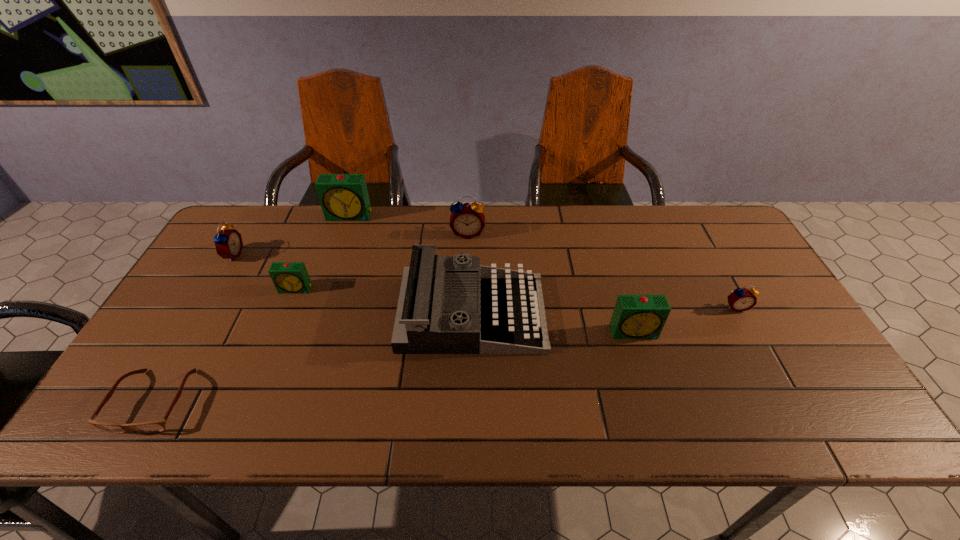
The height and width of the screenshot is (540, 960). In order to click on the second red alarm clock from right to left in this screenshot , I will do coord(467,220).

Identify the location of the third alarm clock from right to left. The height and width of the screenshot is (540, 960). (467, 220).

I want to click on the farthest alarm clock, so tap(343, 197).

Identify the location of the farthest green alarm clock. This screenshot has width=960, height=540. (343, 197).

At what (x,y) coordinates should I click in order to perform the action: click on typewriter. Please return your answer as a coordinate pair (x, y). This screenshot has width=960, height=540. Looking at the image, I should click on (447, 304).

Find the location of a particular element. the leftmost red alarm clock is located at coordinates (228, 242).

Locate an element on the screen. the second biggest red alarm clock is located at coordinates (228, 242).

This screenshot has width=960, height=540. What are the coordinates of `the nearest alarm clock` in the screenshot? It's located at (635, 316).

Where is `the second object from right to left`? The height and width of the screenshot is (540, 960). the second object from right to left is located at coordinates (635, 316).

In order to click on the rightmost object in this screenshot , I will do point(741,299).